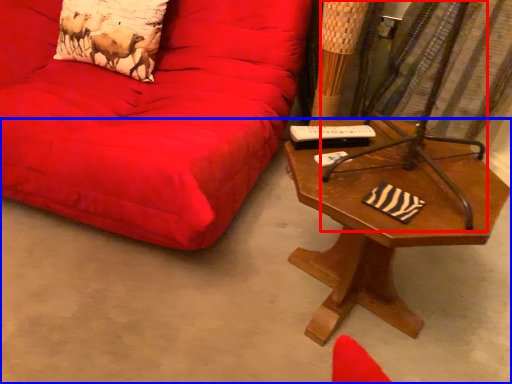
Question: Among these objects, which one is nearest to the camera, swivel chair (highlighted by a red box) or concrete (highlighted by a blue box)?

Choices:
 (A) swivel chair
 (B) concrete

Answer: (B)